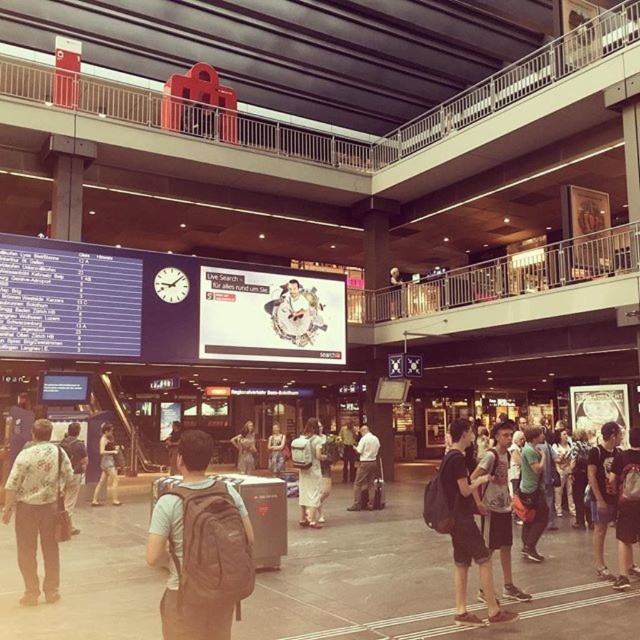
Does light gray backpack at center appear over light brown fabric dress at center?

Yes.

Which is more to the right, light gray backpack at center or light brown fabric dress at center?

Positioned to the right is light gray backpack at center.

Which is behind, point (360, 467) or point (268, 435)?

The point (268, 435) is more distant.

Where is `light gray backpack at center`? light gray backpack at center is located at coordinates (364, 468).

Which is more to the left, floral shirt at left or denim shorts at center?

denim shorts at center

The image size is (640, 640). Describe the element at coordinates (36, 509) in the screenshot. I see `floral shirt at left` at that location.

Between point (36, 513) and point (104, 445), which one is positioned behind?

Positioned behind is point (104, 445).

Where is `floral shirt at left`? This screenshot has height=640, width=640. floral shirt at left is located at coordinates (36, 509).

Can you confirm if floral shirt at left is positioned to the right of light brown fabric dress at center?

Incorrect, floral shirt at left is not on the right side of light brown fabric dress at center.

Is floral shirt at left further to the viewer compared to light brown fabric dress at center?

No, it is not.

Locate an element on the screen. floral shirt at left is located at coordinates (36, 509).

This screenshot has height=640, width=640. I want to click on floral shirt at left, so (x=36, y=509).